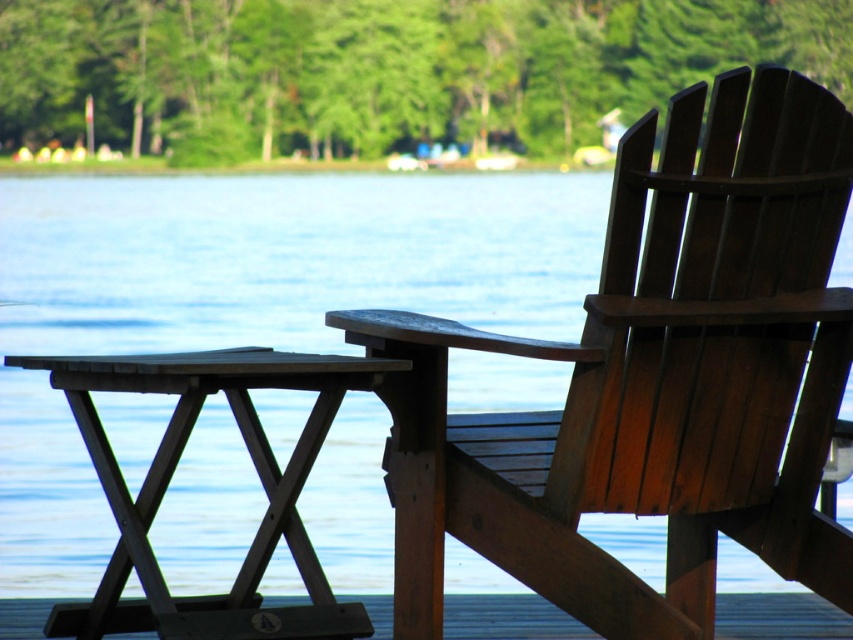
Question: Which point appears farthest from the camera in this image?

Choices:
 (A) (514, 566)
 (B) (277, 467)
 (C) (490, 611)

Answer: (C)

Question: Can you confirm if wooden picnic table at lower left is thinner than wooden deck at lower center?

Choices:
 (A) no
 (B) yes

Answer: (A)

Question: Which point appears farthest from the camera in this image?

Choices:
 (A) (839, 621)
 (B) (550, 432)
 (C) (305, 433)

Answer: (A)

Question: Which of the following is the closest to the observer?

Choices:
 (A) (750, 522)
 (B) (815, 628)

Answer: (A)

Question: Is wooden chair at right positioned at the back of wooden picnic table at lower left?

Choices:
 (A) yes
 (B) no

Answer: (B)

Question: Can you confirm if wooden picnic table at lower left is positioned to the right of wooden deck at lower center?

Choices:
 (A) yes
 (B) no

Answer: (B)